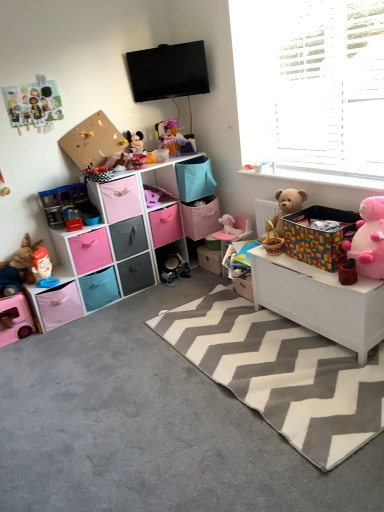
Where is `blank space situated above gray carpet at lower left (from a real-world perspective)`? Image resolution: width=384 pixels, height=512 pixels. blank space situated above gray carpet at lower left (from a real-world perspective) is located at coordinates (182, 364).